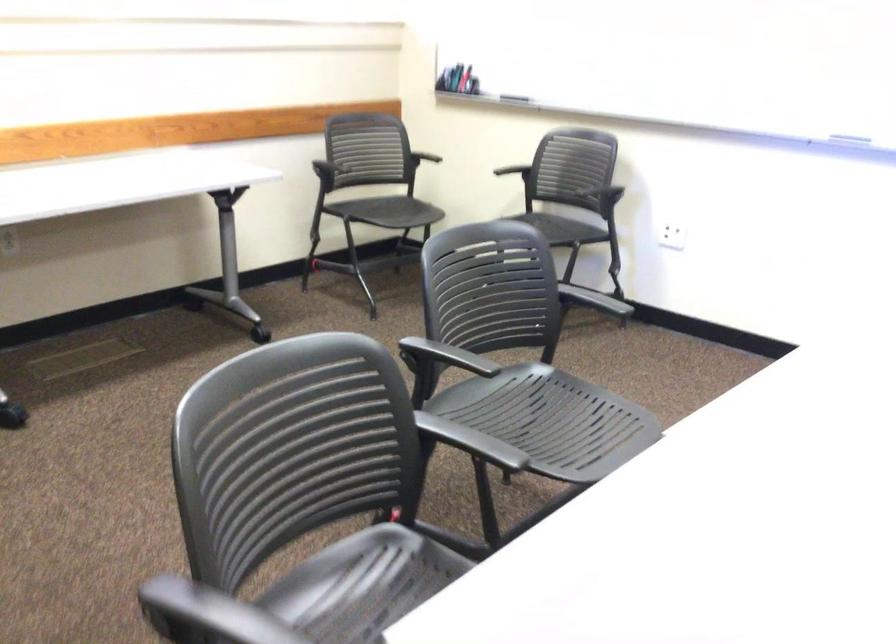
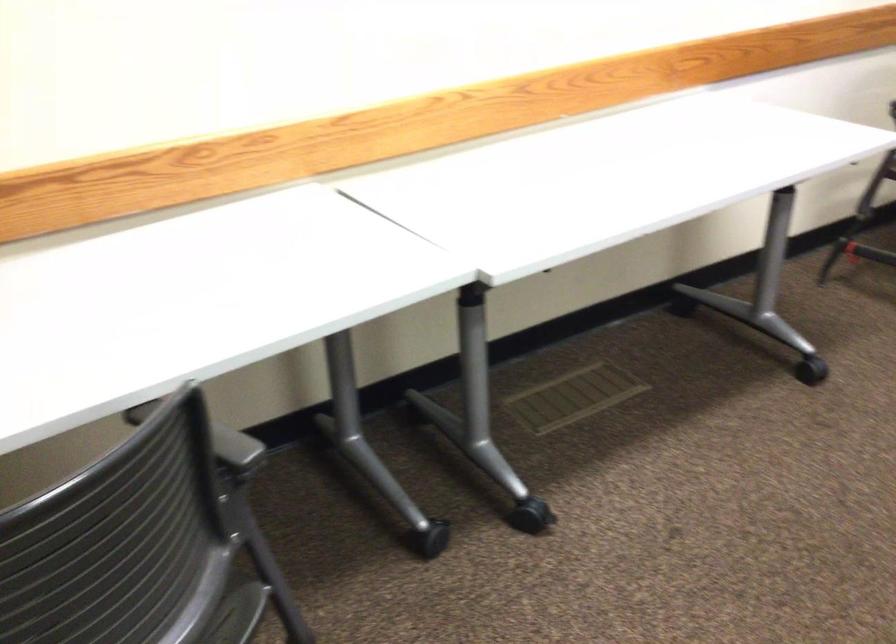
What movement of the cameraman would produce the second image?

The cameraman moved toward left, forward.